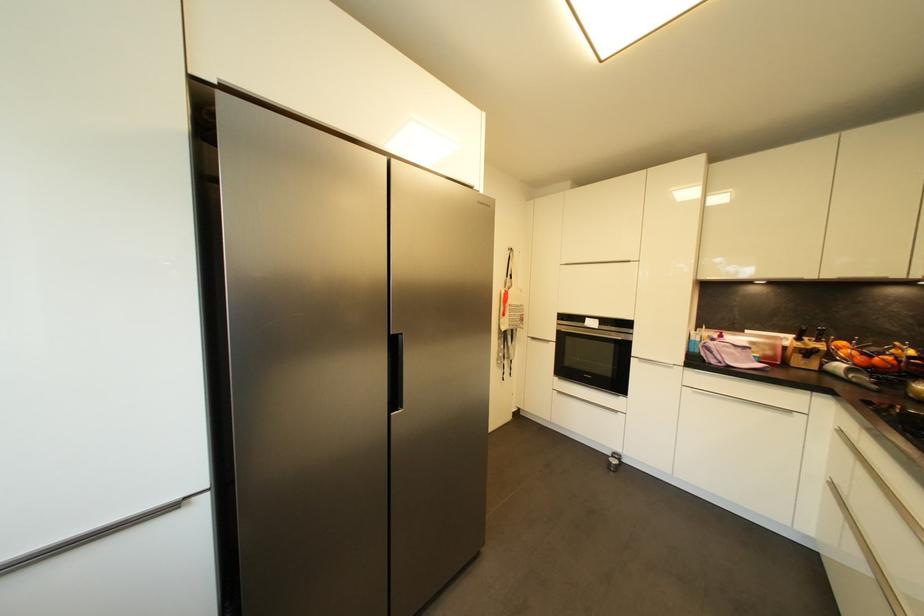
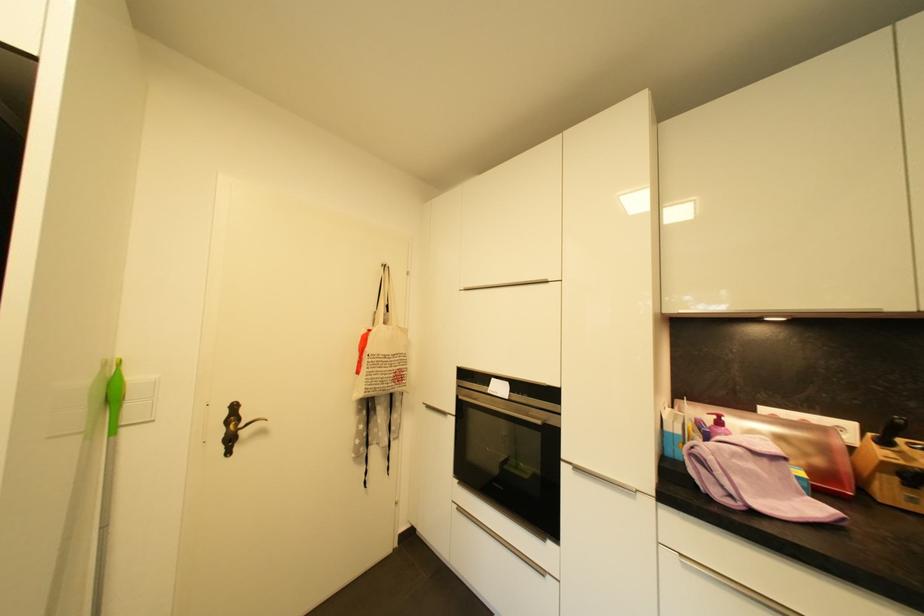
Locate, in the second image, the point that corresponds to (x=804, y=342) in the first image.

(890, 445)